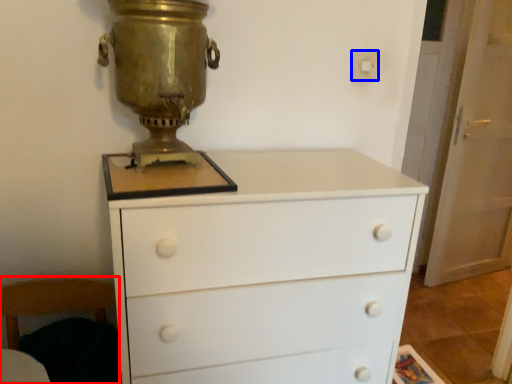
Question: Among these objects, which one is farthest to the camera, armchair (highlighted by a red box) or electric outlet (highlighted by a blue box)?

Choices:
 (A) armchair
 (B) electric outlet

Answer: (B)